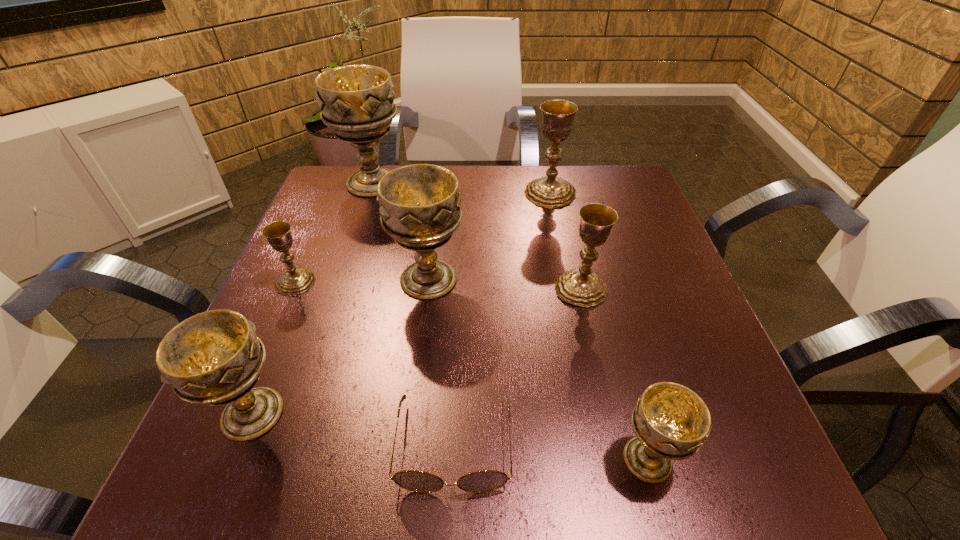
Select which white chalice is the closest to the second farthest white chalice. Please provide its 2D coordinates. Your answer should be formatted as a tuple, i.e. [(x, y)], where the tuple contains the x and y coordinates of a point satisfying the conditions above.

[(214, 358)]

Select which gold chalice appears as the closest to the tallest object. Please provide its 2D coordinates. Your answer should be formatted as a tuple, i.e. [(x, y)], where the tuple contains the x and y coordinates of a point satisfying the conditions above.

[(295, 281)]

Locate an element on the screen. The width and height of the screenshot is (960, 540). gold chalice that is the closest one to the smallest gold chalice is located at coordinates (580, 287).

Identify the location of vacant point that satisfies the following two spatial constraints: 1. on the front side of the smallest white chalice; 2. on the left side of the third biggest white chalice. (234, 459).

Identify the location of blank area in the image that satisfies the following two spatial constraints: 1. on the front side of the tallest object; 2. on the right side of the second farthest white chalice. This screenshot has width=960, height=540. (342, 280).

Where is `vacant region that satisfies the following two spatial constraints: 1. on the front side of the second biggest gold chalice; 2. on the left side of the farthest white chalice`? This screenshot has width=960, height=540. vacant region that satisfies the following two spatial constraints: 1. on the front side of the second biggest gold chalice; 2. on the left side of the farthest white chalice is located at coordinates (339, 288).